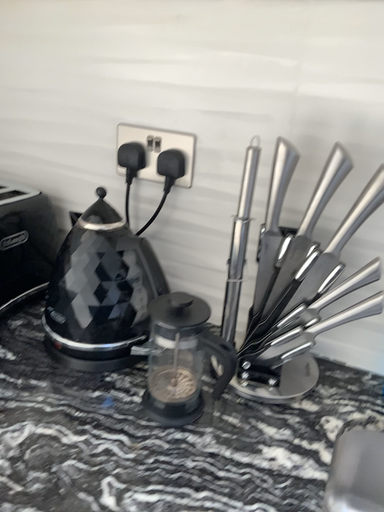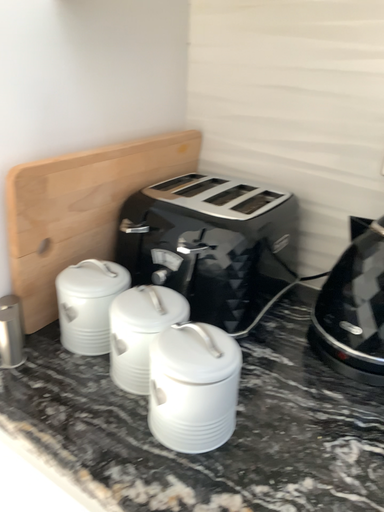
Question: Which way did the camera rotate in the video?

Choices:
 (A) rotated left
 (B) rotated right

Answer: (A)